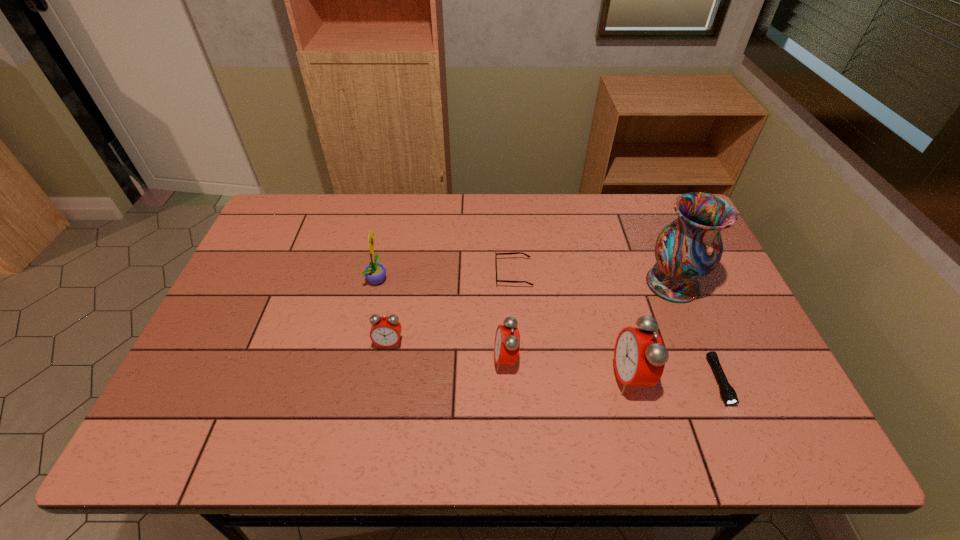
Locate an element on the screen. The image size is (960, 540). free space at the far right corner of the desktop is located at coordinates (659, 208).

The width and height of the screenshot is (960, 540). I want to click on empty space that is in between the rightmost alarm clock and the flashlight, so click(675, 379).

Find the location of a particular element. empty space between the third object from right to left and the flashlight is located at coordinates 675,379.

Where is `free space between the sunglasses and the flashlight`? free space between the sunglasses and the flashlight is located at coordinates (616, 327).

Identify the location of vacant space that's between the flashlight and the vase. The image size is (960, 540). (696, 333).

The image size is (960, 540). I want to click on free area in between the flashlight and the tallest object, so pyautogui.click(x=696, y=333).

Locate an element on the screen. free space between the second alarm clock from right to left and the tallest object is located at coordinates (589, 322).

Where is `vacant area that lies between the second tallest alarm clock and the sunglasses`? This screenshot has height=540, width=960. vacant area that lies between the second tallest alarm clock and the sunglasses is located at coordinates (510, 316).

Where is `vacant space in between the vase and the second alarm clock from right to left`? The height and width of the screenshot is (540, 960). vacant space in between the vase and the second alarm clock from right to left is located at coordinates [589, 322].

This screenshot has width=960, height=540. Find the location of `free space between the sunflower and the flashlight`. free space between the sunflower and the flashlight is located at coordinates (548, 330).